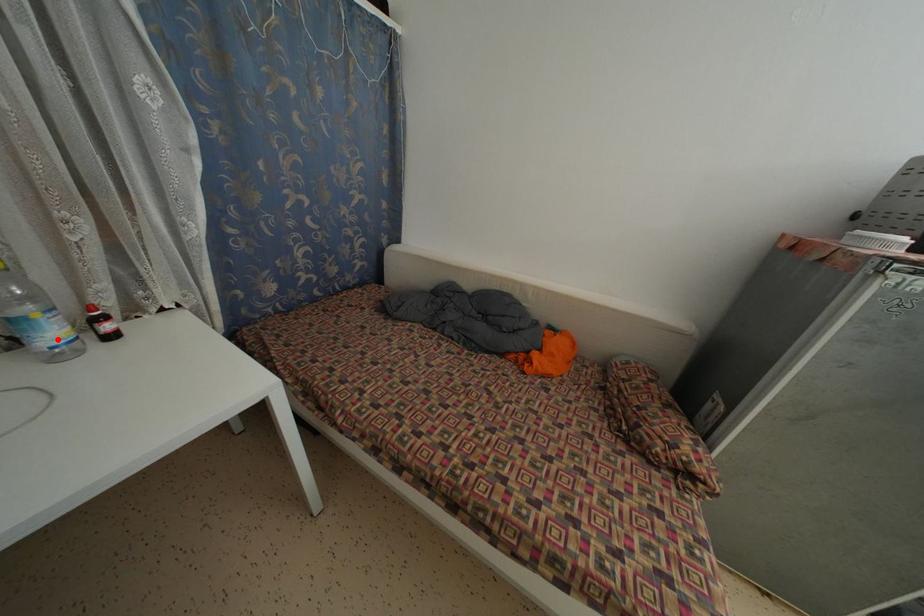
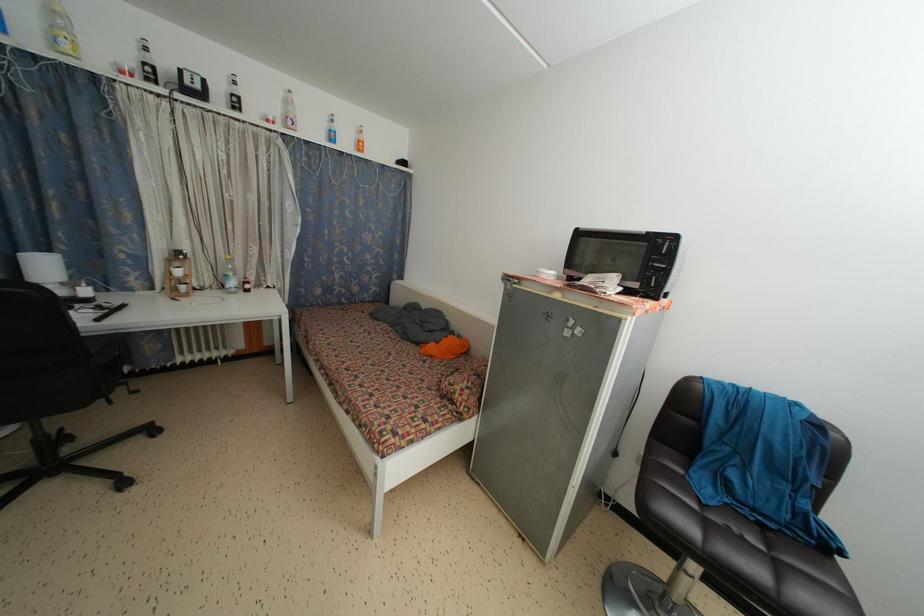
Where in the second image is the point corresponding to the highlighted location from the first image?

(237, 289)